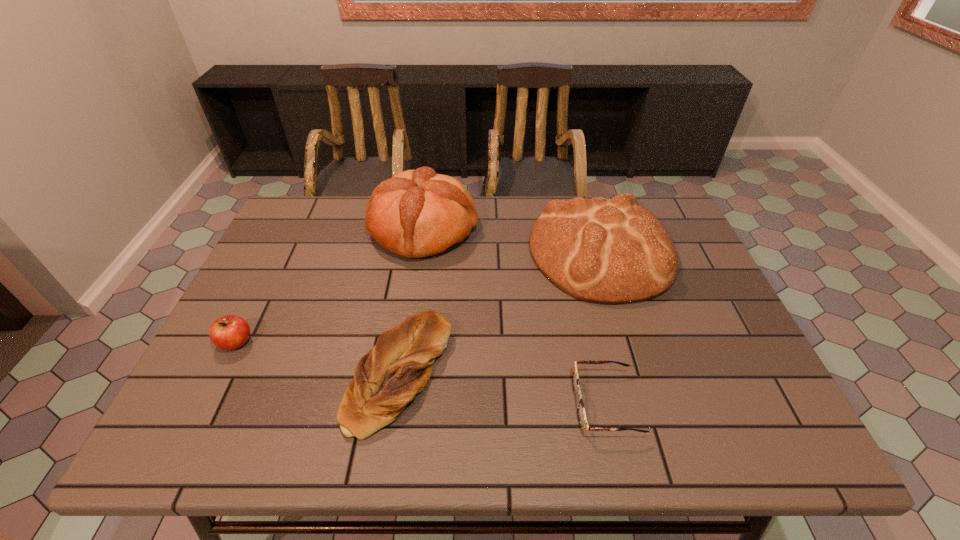
The image size is (960, 540). Find the location of `vacant point that satisfies the following two spatial constraints: 1. on the front side of the rightmost bread; 2. on the frame of the spectacles`. vacant point that satisfies the following two spatial constraints: 1. on the front side of the rightmost bread; 2. on the frame of the spectacles is located at coordinates (647, 404).

Find the location of a particular element. This screenshot has width=960, height=540. free space in the image that satisfies the following two spatial constraints: 1. on the front side of the apple; 2. on the left side of the second shortest object is located at coordinates (221, 374).